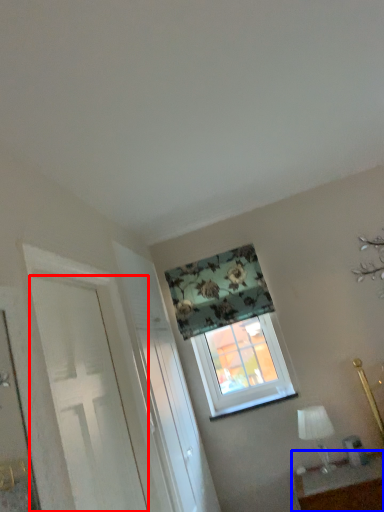
Question: Which object is further to the camera taking this photo, door (highlighted by a red box) or table (highlighted by a blue box)?

Choices:
 (A) door
 (B) table

Answer: (B)